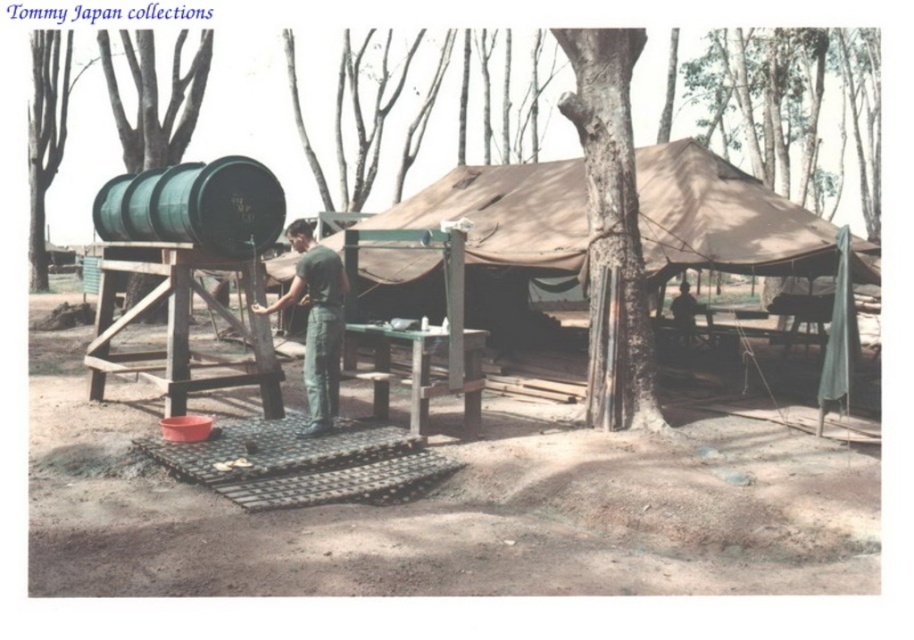
Question: Which point appears closest to the camera in this image?

Choices:
 (A) (606, 269)
 (B) (533, 227)

Answer: (A)

Question: Does beige canvas tent at center have a lesser width compared to green matte barrel at left?

Choices:
 (A) yes
 (B) no

Answer: (A)

Question: Based on their relative distances, which object is nearer to the beige canvas tent at center?

Choices:
 (A) green matte uniform at center
 (B) green bark tree at left

Answer: (A)

Question: Can you confirm if beige canvas tent at center is thinner than green matte barrel at left?

Choices:
 (A) no
 (B) yes

Answer: (B)

Question: Does beige canvas tent at center appear on the left side of dark green uniform at center?

Choices:
 (A) yes
 (B) no

Answer: (A)

Question: Which point is closer to the camera?

Choices:
 (A) (314, 273)
 (B) (48, 51)
 (C) (508, 230)
 (D) (670, 307)

Answer: (A)